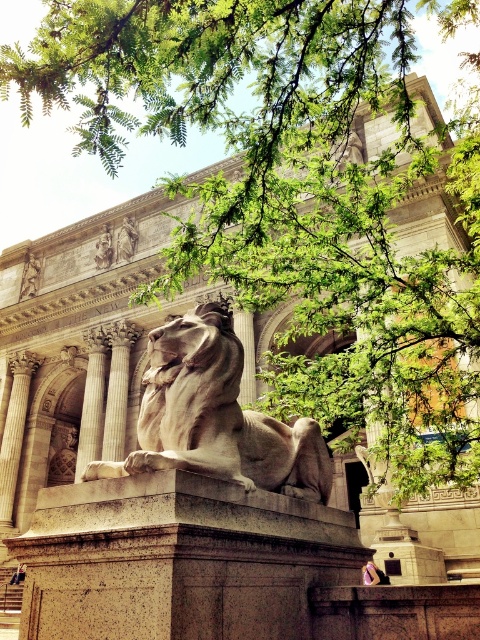
You are an architect visiting this building and need to determine the spatial relationship between the white stone lion at center and the gray stone column at center. Which one has a greater height?

The white stone lion at center is taller than the gray stone column at center according to the description.

You are an architect planning to place a new sculpture between the white stone lion at center and the beige stone column at left. The sculpture requires a minimum of 30 meters of space between these two landmarks. Will there be enough space?

The distance between the white stone lion at center and the beige stone column at left is 32.17 meters, which exceeds the required 30 meters. Therefore, there is sufficient space for the sculpture.